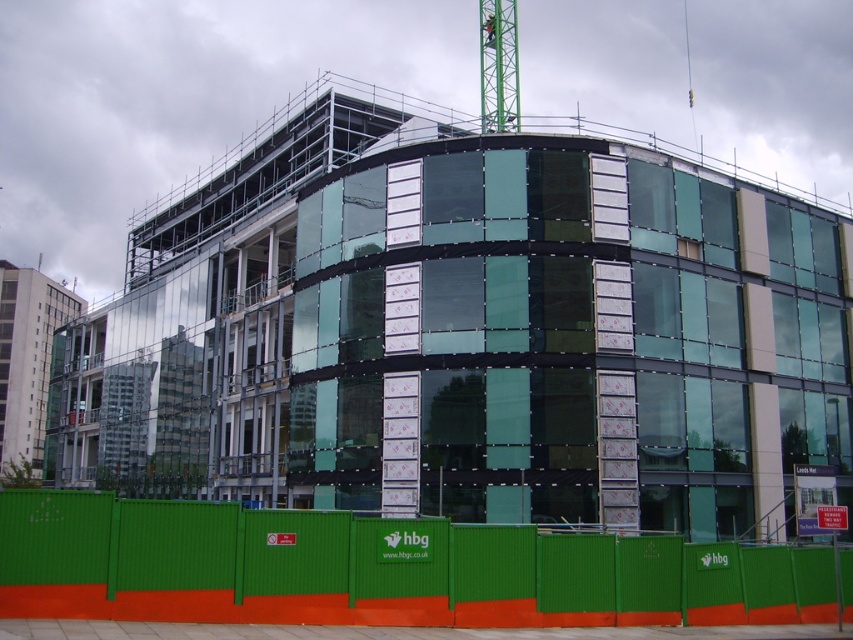
Question: Does green glass building at center appear under green corrugated plastic at lower center?

Choices:
 (A) no
 (B) yes

Answer: (A)

Question: Which point appears closest to the camera in this image?

Choices:
 (A) (492, 81)
 (B) (534, 552)
 (C) (630, 484)

Answer: (B)

Question: Estimate the real-world distances between objects in this image. Which object is closer to the green metallic crane at upper center?

Choices:
 (A) green corrugated plastic at lower center
 (B) green glass building at center

Answer: (B)

Question: Which point is closer to the camera?

Choices:
 (A) green corrugated plastic at lower center
 (B) green metallic crane at upper center
 (C) green glass building at center

Answer: (A)

Question: Can you confirm if green corrugated plastic at lower center is wider than green metallic crane at upper center?

Choices:
 (A) yes
 (B) no

Answer: (A)

Question: Does green corrugated plastic at lower center appear on the right side of green metallic crane at upper center?

Choices:
 (A) no
 (B) yes

Answer: (A)